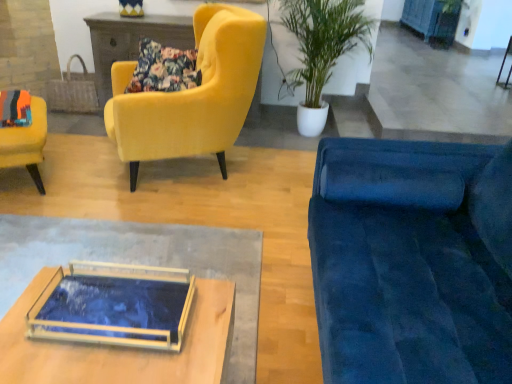
Question: Considering the relative sizes of yellow and blue striped vase at upper center and blue painted wood cabinet at upper right in the image provided, is yellow and blue striped vase at upper center shorter than blue painted wood cabinet at upper right?

Choices:
 (A) yes
 (B) no

Answer: (A)

Question: From a real-world perspective, is yellow and blue striped vase at upper center located higher than blue painted wood cabinet at upper right?

Choices:
 (A) no
 (B) yes

Answer: (B)

Question: Would you say yellow and blue striped vase at upper center contains blue painted wood cabinet at upper right?

Choices:
 (A) yes
 (B) no

Answer: (B)

Question: Can you confirm if yellow and blue striped vase at upper center is positioned to the left of blue painted wood cabinet at upper right?

Choices:
 (A) yes
 (B) no

Answer: (A)

Question: Is yellow and blue striped vase at upper center positioned in front of blue painted wood cabinet at upper right?

Choices:
 (A) yes
 (B) no

Answer: (A)

Question: From a real-world perspective, is translucent glass tray at center positioned above or below yellow and blue striped vase at upper center?

Choices:
 (A) below
 (B) above

Answer: (A)

Question: From the image's perspective, is translucent glass tray at center positioned above or below yellow and blue striped vase at upper center?

Choices:
 (A) above
 (B) below

Answer: (B)

Question: Is translucent glass tray at center wider or thinner than yellow and blue striped vase at upper center?

Choices:
 (A) wide
 (B) thin

Answer: (A)

Question: Considering the relative positions of translucent glass tray at center and yellow and blue striped vase at upper center in the image provided, is translucent glass tray at center to the left or to the right of yellow and blue striped vase at upper center?

Choices:
 (A) right
 (B) left

Answer: (A)

Question: From a real-world perspective, is woven straw handbag at upper left positioned above or below velvet blue couch at right?

Choices:
 (A) below
 (B) above

Answer: (A)

Question: Considering the positions of point [x=83, y=107] and point [x=368, y=271], is point [x=83, y=107] closer or farther from the camera than point [x=368, y=271]?

Choices:
 (A) closer
 (B) farther

Answer: (B)

Question: Considering the relative positions of woven straw handbag at upper left and velvet blue couch at right in the image provided, is woven straw handbag at upper left to the left or to the right of velvet blue couch at right?

Choices:
 (A) right
 (B) left

Answer: (B)

Question: Looking at the image, does woven straw handbag at upper left seem bigger or smaller compared to velvet blue couch at right?

Choices:
 (A) small
 (B) big

Answer: (A)

Question: In the image, is velvet yellow armchair at upper left, the second chair positioned from the left, positioned in front of or behind blue painted wood cabinet at upper right?

Choices:
 (A) front
 (B) behind

Answer: (A)

Question: In the image, is velvet yellow armchair at upper left, the second chair positioned from the left, on the left side or the right side of blue painted wood cabinet at upper right?

Choices:
 (A) left
 (B) right

Answer: (A)